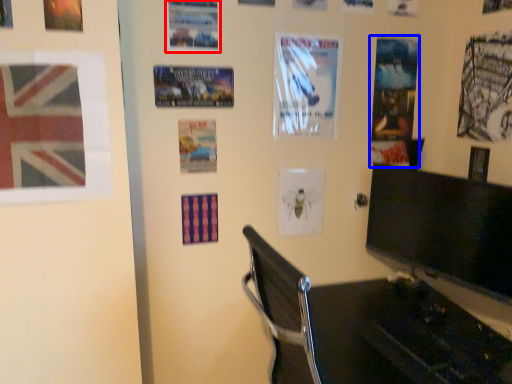
Question: Among these objects, which one is nearest to the camera, poster (highlighted by a red box) or poster page (highlighted by a blue box)?

Choices:
 (A) poster
 (B) poster page

Answer: (A)